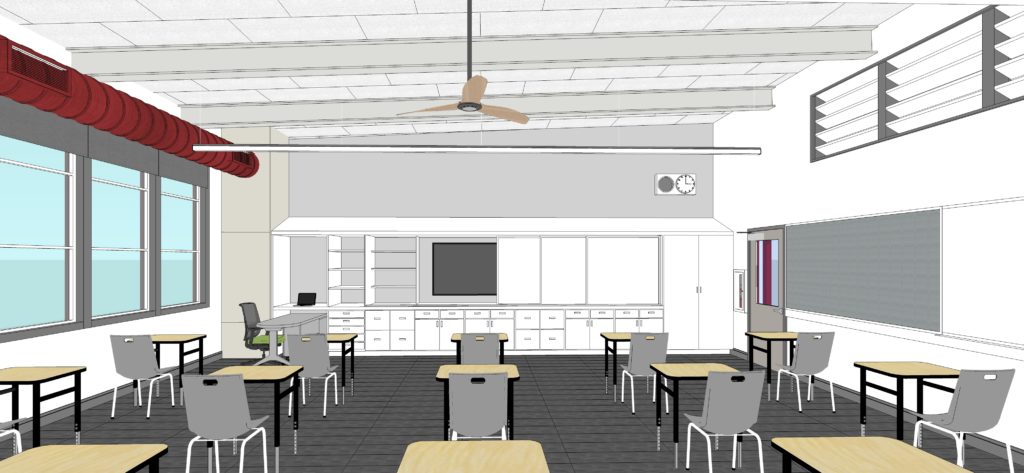
Find the location of a particular element. chairs is located at coordinates click(226, 409), click(484, 410), click(741, 412), click(975, 409), click(822, 352), click(636, 350), click(480, 353), click(297, 350), click(144, 354), click(245, 313).